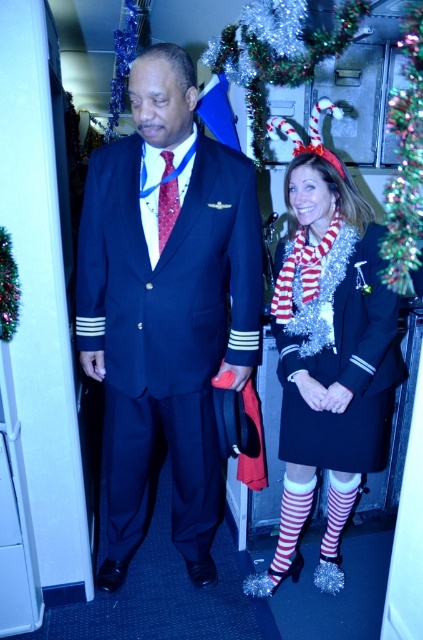
Question: Which point is closer to the camera taking this photo?

Choices:
 (A) (395, 340)
 (B) (247, 220)

Answer: (B)

Question: Which of the following is the farthest from the observer?

Choices:
 (A) (334, 282)
 (B) (305, 312)
 (C) (198, 278)

Answer: (B)

Question: Which point appears closest to the camera in this image?

Choices:
 (A) (362, 419)
 (B) (335, 285)
 (C) (109, 572)

Answer: (B)

Question: Can you confirm if shiny dark blue suit at center is positioned to the left of shiny silver dress at center?

Choices:
 (A) no
 (B) yes

Answer: (B)

Question: Does red and white striped stockings at right appear over shiny silver dress at center?

Choices:
 (A) yes
 (B) no

Answer: (B)

Question: From the image, what is the correct spatial relationship of shiny dark blue suit at center in relation to red and white striped stockings at right?

Choices:
 (A) below
 (B) above

Answer: (B)